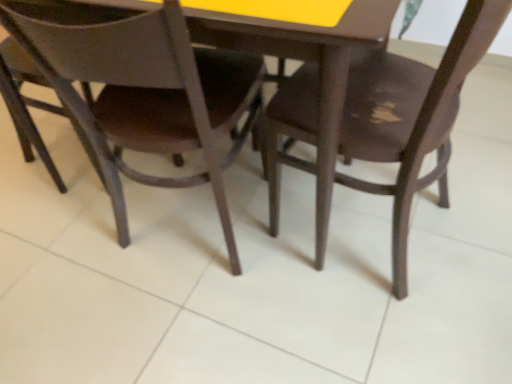
What are the coordinates of `free space in front of matte brown chair at center, the 2th chair when ordered from right to left` in the screenshot? It's located at (200, 329).